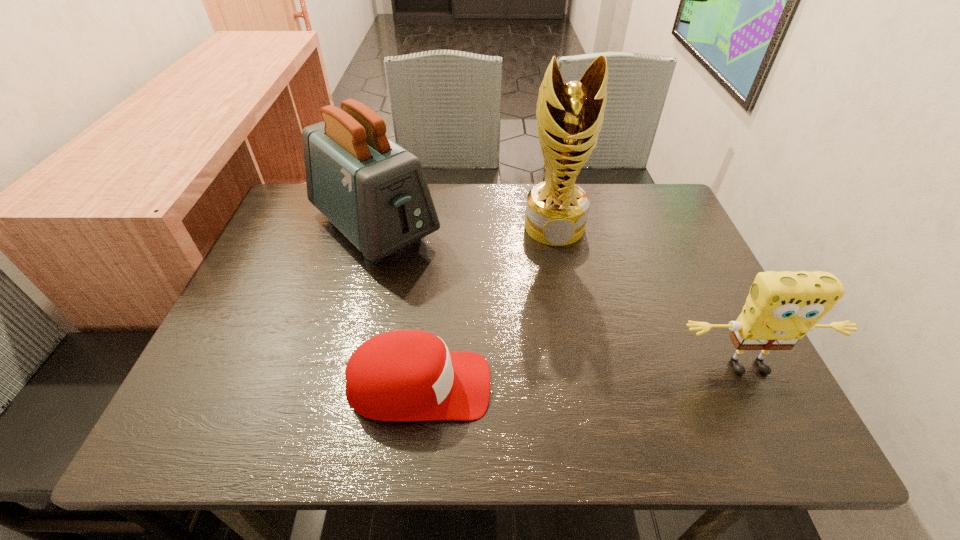
I want to click on unoccupied position between the rightmost object and the award, so click(652, 298).

Find the location of a particular element. The height and width of the screenshot is (540, 960). vacant space that is in between the tallest object and the sponge is located at coordinates (652, 298).

Identify the location of free space between the toaster and the baseball cap. (397, 307).

The width and height of the screenshot is (960, 540). What are the coordinates of `free space between the award and the toaster` in the screenshot? It's located at (465, 227).

I want to click on vacant space in between the tallest object and the sponge, so click(652, 298).

This screenshot has height=540, width=960. Find the location of `free spot between the tallest object and the second tallest object`. free spot between the tallest object and the second tallest object is located at coordinates (x=465, y=227).

I want to click on vacant space that's between the third tallest object and the toaster, so click(x=562, y=298).

At what (x,y) coordinates should I click in order to perform the action: click on object that can be found as the third closest to the rightmost object. Please return your answer as a coordinate pair (x, y). Image resolution: width=960 pixels, height=540 pixels. Looking at the image, I should click on (375, 192).

Locate an element on the screen. This screenshot has height=540, width=960. object that stands as the second closest to the shortest object is located at coordinates (569, 117).